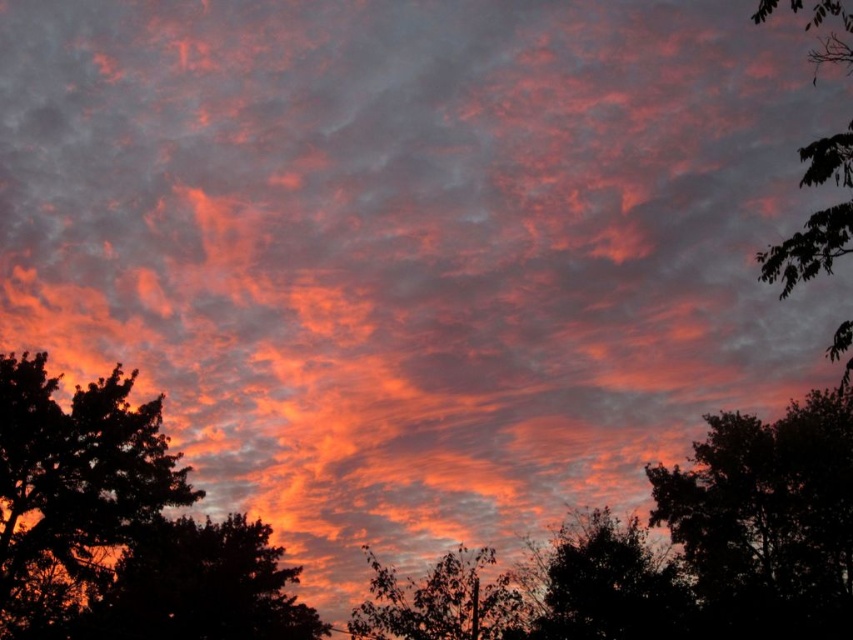
In the scene shown: You are an artist trying to paint the sunset scene. You notice two trees in the foreground. Which tree, the dark green leafy tree at lower left or the green leafy tree at center, should you paint taller to accurately represent their sizes in the image?

The dark green leafy tree at lower left should be painted much taller than the green leafy tree at center.

You are an artist trying to paint the sunset scene. You want to place the dark green leafy tree at lower left and the green leafy tree at center in your painting. Based on the scene, which tree should you paint first to create the illusion of depth?

You should paint the dark green leafy tree at lower left first because the green leafy tree at center is behind it, so painting the foreground tree first allows the background tree to be layered over it to create depth.

Consider the image. You are an artist trying to paint the sunset scene. You want to ensure the green leafy tree at right is visible in your painting. Given that the silhouette tree at left is in front of it, how should you position them to maintain the tree at right visible?

To keep the green leafy tree at right visible, paint the silhouette tree at left in front but ensure the green leafy tree at right extends beyond the silhouette tree at left so its details can still be seen.